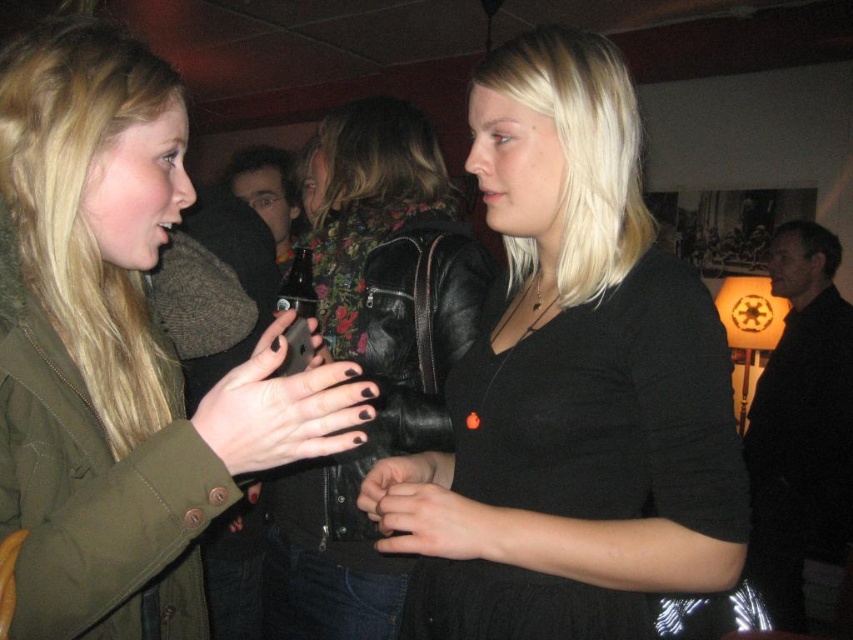
You are a photographer at this event. You want to take a photo of the black matte shirt at center and the matte black phone at center. Which object is closer to you so that you can focus on it first?

The black matte shirt at center is closer to you than the matte black phone at center, so you can focus on it first.

You are at a party and want to take a photo of the two women talking. You notice two points in the scene labeled as point (521,104) and point (291,336). If you want to focus on the closer point to ensure the photo is clear, which point should you choose?

Point (521,104) is further to the viewer than point (291,336), so you should focus on point (291,336) to ensure the photo is clear.